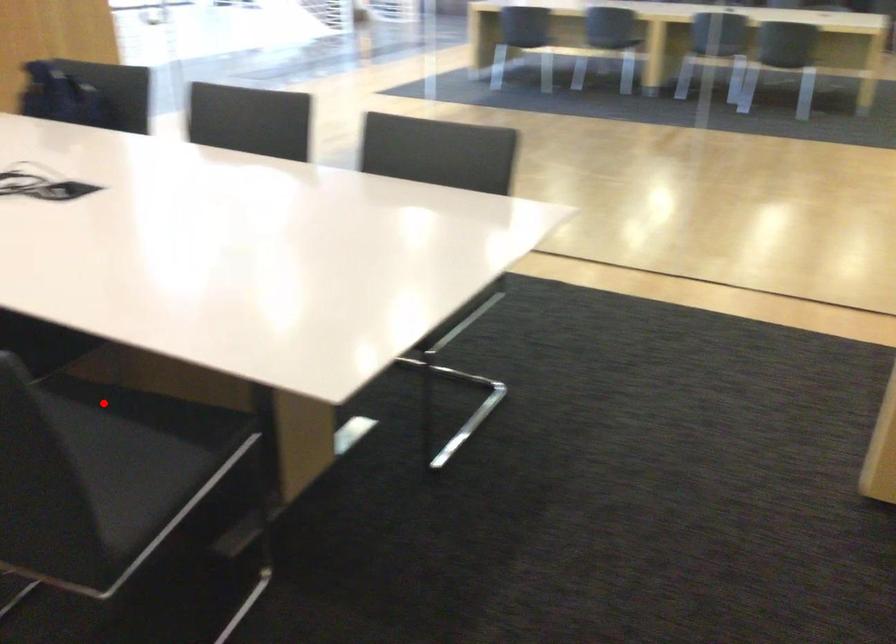
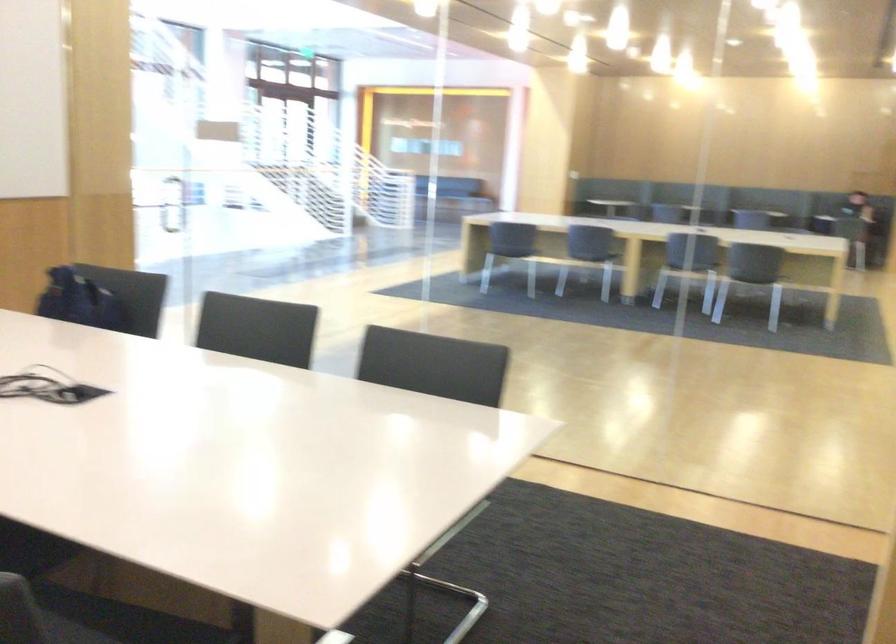
Find the pixel in the second image that matches the highlighted location in the first image.

(88, 618)